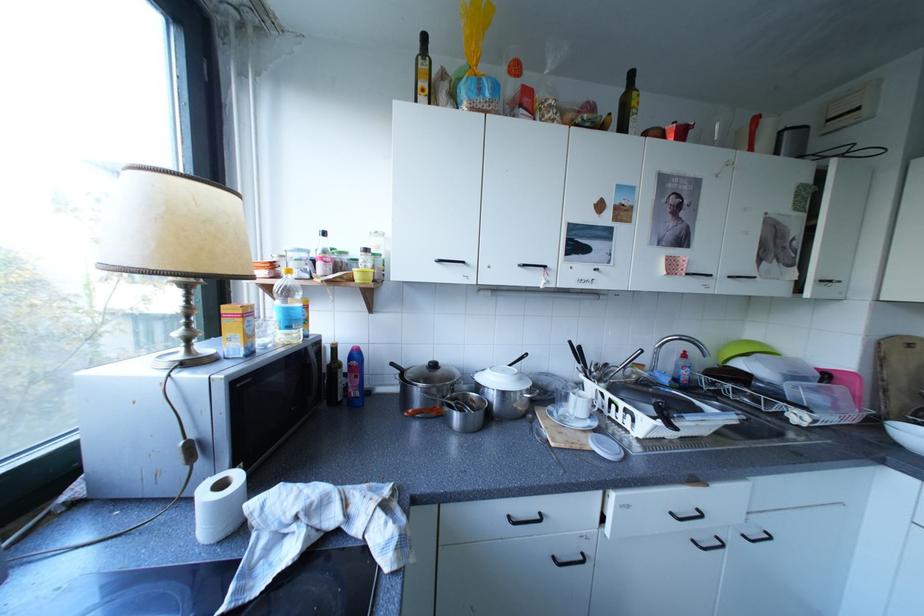
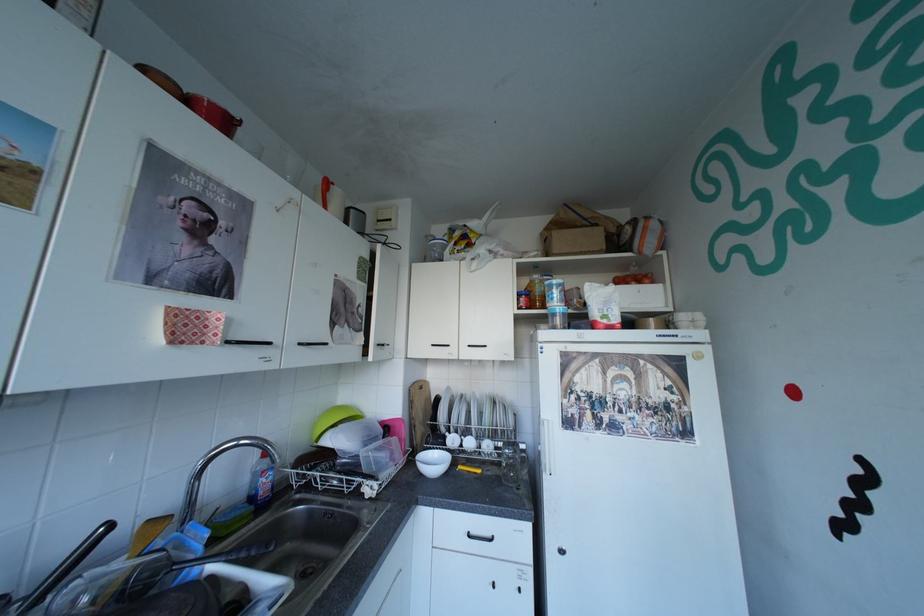
Question: The camera is either moving clockwise (left) or counter-clockwise (right) around the object. The first image is from the beginning of the video and the second image is from the end. Is the camera moving left or right when shooting the video?

Choices:
 (A) Left
 (B) Right

Answer: (A)